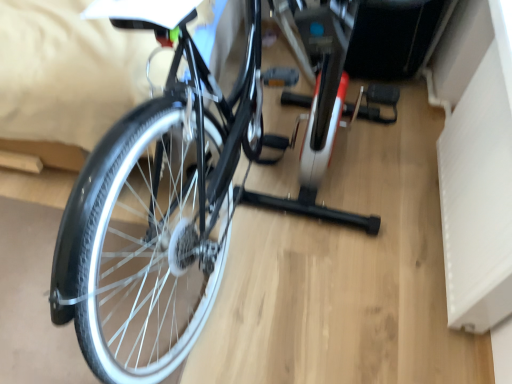
Image resolution: width=512 pixels, height=384 pixels. I want to click on matte black bicycle at center, so click(164, 208).

What do you see at coordinates (164, 208) in the screenshot? This screenshot has height=384, width=512. I see `matte black bicycle at center` at bounding box center [164, 208].

Locate an element on the screen. The image size is (512, 384). matte black bicycle at center is located at coordinates (164, 208).